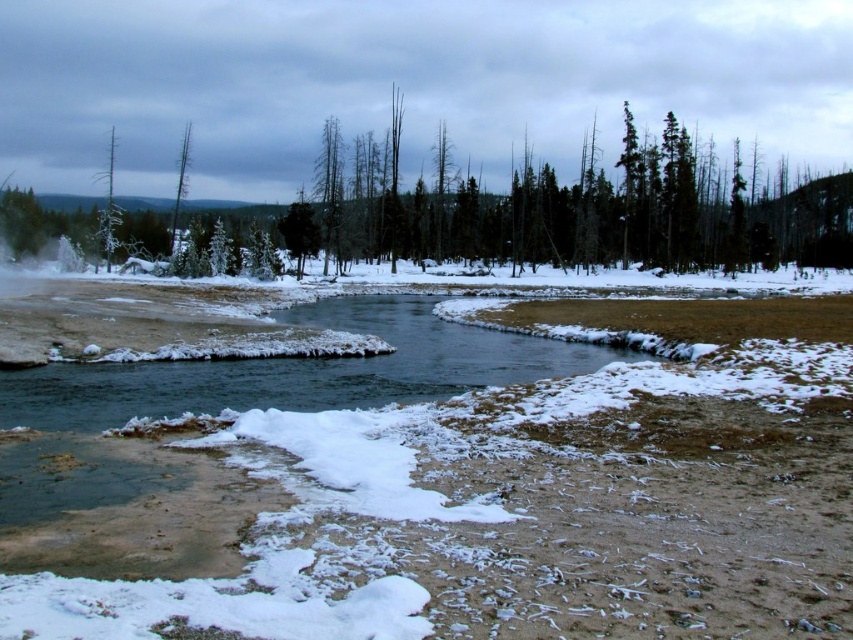
You are an explorer navigating a winter forest and see a green matte tree at upper center and a frosty bark tree at upper left. Which tree is closer to the left edge of your view?

The frosty bark tree at upper left is closer to the left edge of your view because the green matte tree at upper center is positioned on the right side of it.

You are an observer standing at the edge of the river in the winter scene. You notice two trees in the upper part of the image. Which tree is taller between the green matte tree at upper center and the dead wood tree at upper left?

The green matte tree at upper center is taller than the dead wood tree at upper left.

You are an observer standing at the riverbank in the winter scene. You notice two trees in the distance. The green matte tree at upper center and the frosty bark tree at upper left. Which tree would appear larger to you based on their positions?

The green matte tree at upper center appears larger because it is closer to the viewer compared to the frosty bark tree at upper left.